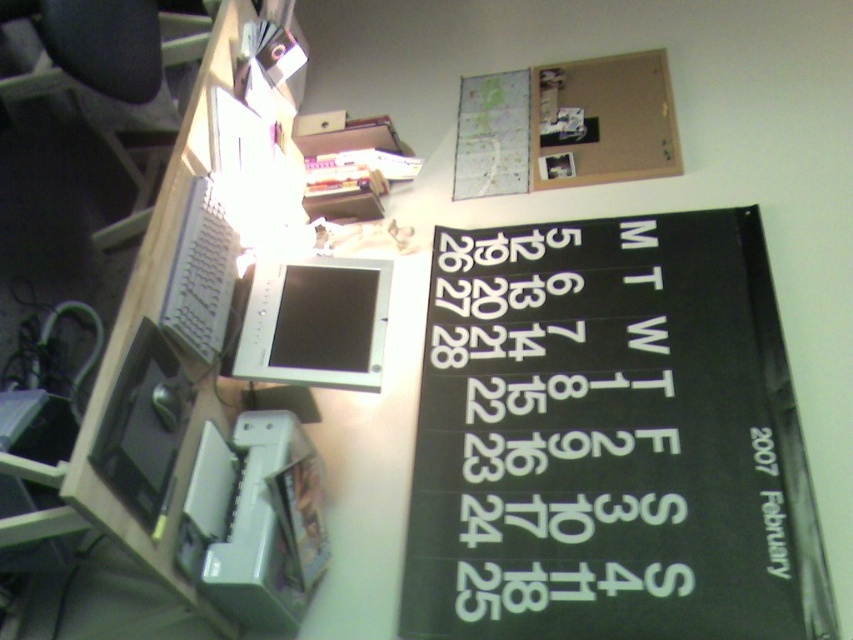
Measure the distance between white plastic printer at lower center and white plastic keyboard at left.

white plastic printer at lower center is 33.27 centimeters from white plastic keyboard at left.

Can you confirm if white plastic printer at lower center is thinner than white plastic keyboard at left?

Incorrect, white plastic printer at lower center's width is not less than white plastic keyboard at left's.

This screenshot has width=853, height=640. In order to click on white plastic printer at lower center in this screenshot , I will do `click(254, 520)`.

Who is more distant from viewer, (537,412) or (241,566)?

Positioned behind is point (537,412).

You are a GUI agent. You are given a task and a screenshot of the screen. Output one action in this format:
    pyautogui.click(x=<x>, y=<y>)
    Task: Click on the white plastic calendar at right
    This screenshot has height=640, width=853.
    Given the screenshot: What is the action you would take?
    pyautogui.click(x=553, y=435)

Locate an element on the screen. The width and height of the screenshot is (853, 640). white plastic calendar at right is located at coordinates (553, 435).

Is white plastic calendar at right closer to the viewer compared to black matte drawing tablet at lower left?

No.

Between point (548, 472) and point (123, 368), which one is positioned in front?

Point (123, 368)

Where is `white plastic calendar at right`? Image resolution: width=853 pixels, height=640 pixels. white plastic calendar at right is located at coordinates (553, 435).

Find the location of a particular element. white plastic calendar at right is located at coordinates (553, 435).